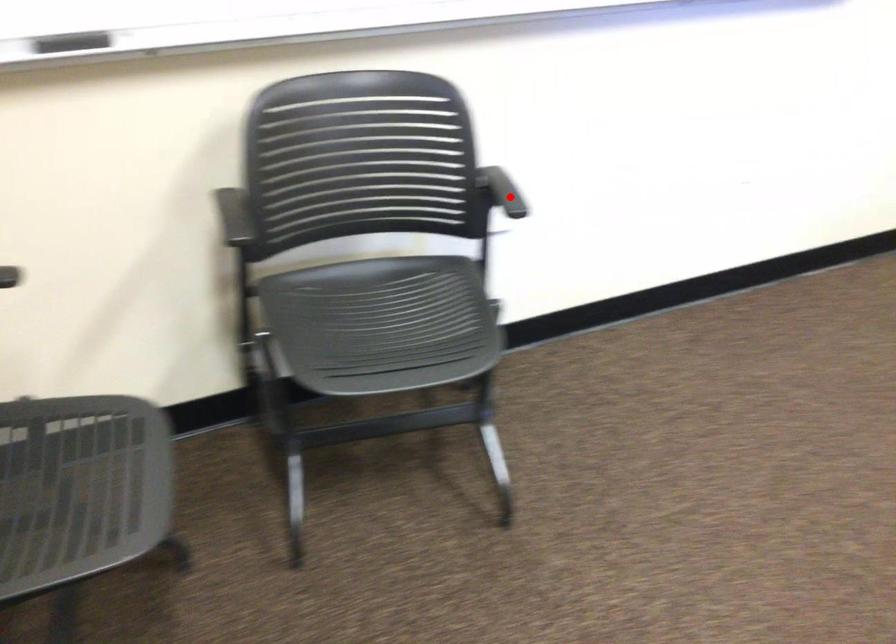
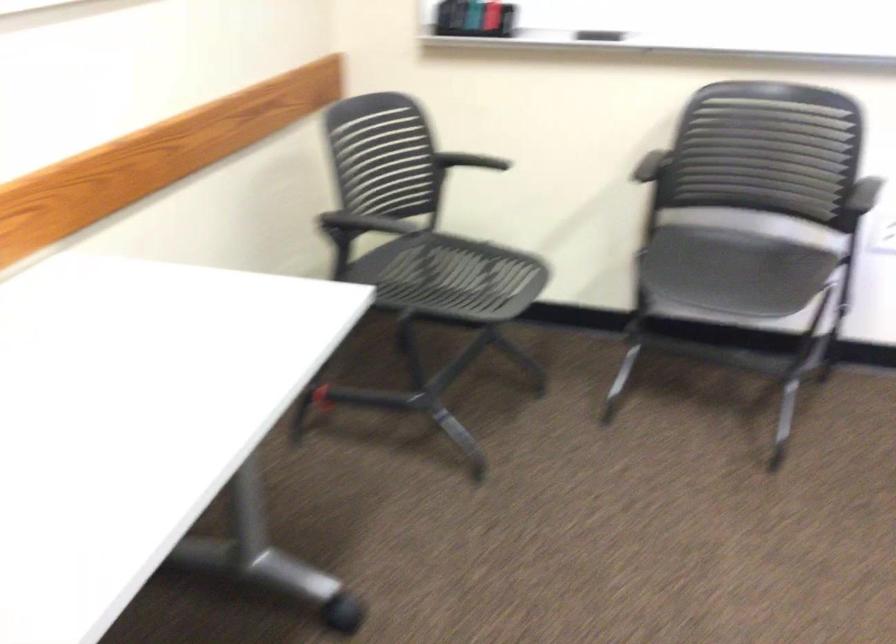
Question: I am providing you with two images of the same scene from different viewpoints. In image1, a red point is highlighted. Considering the same 3D point in image2, which of the following is correct?

Choices:
 (A) It is closer
 (B) It is farther

Answer: (B)